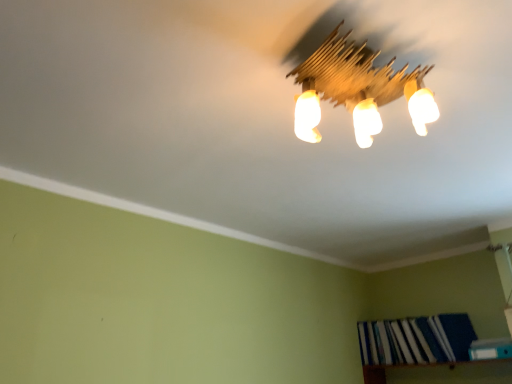
Question: Is wooden light fixture at upper center bigger or smaller than blue hardcover book at lower right, which is counted as the 2th book, starting from the front?

Choices:
 (A) big
 (B) small

Answer: (B)

Question: In terms of width, does wooden light fixture at upper center look wider or thinner when compared to blue hardcover book at lower right, acting as the 1th book starting from the back?

Choices:
 (A) thin
 (B) wide

Answer: (B)

Question: Based on their relative distances, which object is farther from the wooden bookshelf at lower right?

Choices:
 (A) blue fabric book at lower right, arranged as the 2th book when viewed from the back
 (B) wooden light fixture at upper center
 (C) blue hardcover book at lower right, acting as the 1th book starting from the back

Answer: (B)

Question: Considering the real-world distances, which object is closest to the blue hardcover book at lower right, acting as the 1th book starting from the back?

Choices:
 (A) blue fabric book at lower right, arranged as the 2th book when viewed from the back
 (B) wooden light fixture at upper center
 (C) wooden bookshelf at lower right

Answer: (C)